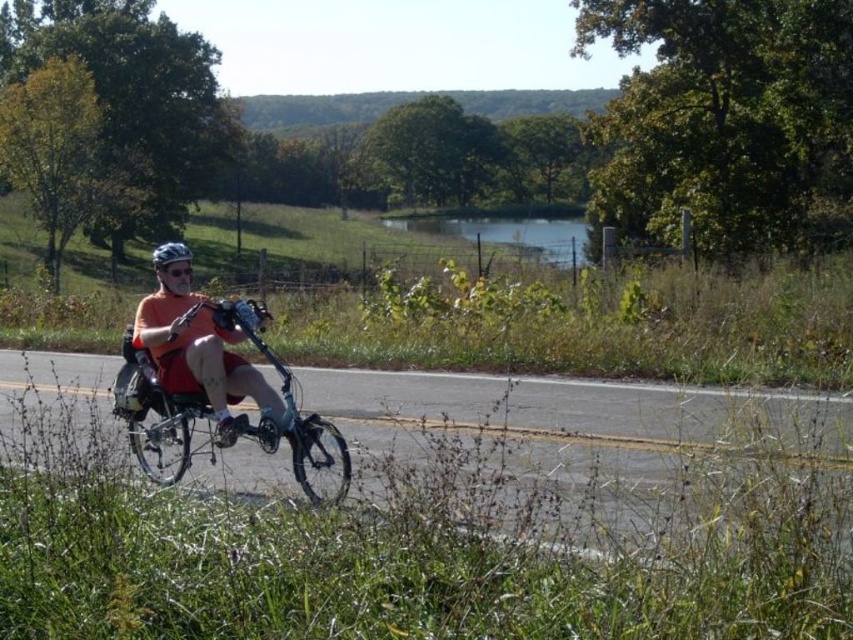
Who is higher up, orange matte shirt at center or matte black helmet at center?

matte black helmet at center

Find the location of a particular element. orange matte shirt at center is located at coordinates (x=200, y=352).

Image resolution: width=853 pixels, height=640 pixels. I want to click on orange matte shirt at center, so click(x=200, y=352).

Between point (337, 484) and point (196, 388), which one is positioned in front?

Positioned in front is point (337, 484).

Who is positioned more to the right, silver metallic bicycle at center or orange matte shirt at center?

Positioned to the right is silver metallic bicycle at center.

Between point (328, 426) and point (134, 316), which one is positioned in front?

Point (328, 426) is more forward.

You are a GUI agent. You are given a task and a screenshot of the screen. Output one action in this format:
    pyautogui.click(x=<x>, y=<y>)
    Task: Click on the silver metallic bicycle at center
    
    Given the screenshot: What is the action you would take?
    pyautogui.click(x=285, y=413)

Is silver metallic bicycle at center above matte black helmet at center?

No.

Is silver metallic bicycle at center to the left of matte black helmet at center from the viewer's perspective?

In fact, silver metallic bicycle at center is to the right of matte black helmet at center.

In order to click on silver metallic bicycle at center in this screenshot , I will do `click(285, 413)`.